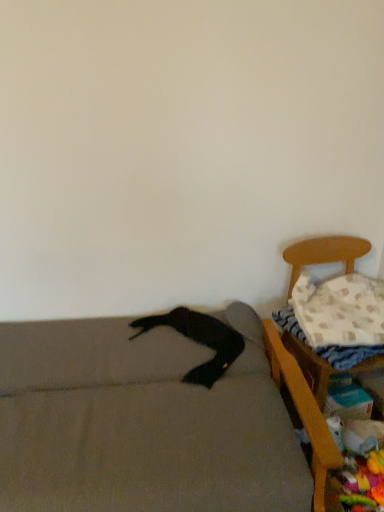
Question: From a real-world perspective, is wooden chair at right, which is counted as the second furniture, starting from the left, physically located above or below white textured pillow at right?

Choices:
 (A) above
 (B) below

Answer: (B)

Question: Is wooden chair at right, which is the 1th furniture in right-to-left order, situated inside white textured pillow at right or outside?

Choices:
 (A) inside
 (B) outside

Answer: (B)

Question: Which object is the closest to the white textured blanket at right?

Choices:
 (A) white textured pillow at right
 (B) wooden chair at right, which is counted as the second furniture, starting from the left
 (C) soft gray couch at lower left, arranged as the 2th furniture when viewed from the right
 (D) black fabric pants at lower left

Answer: (A)

Question: Which of these objects is positioned farthest from the black fabric pants at lower left?

Choices:
 (A) white textured blanket at right
 (B) wooden chair at right, which is the 1th furniture in right-to-left order
 (C) white textured pillow at right
 (D) soft gray couch at lower left, which appears as the first furniture when viewed from the left

Answer: (C)